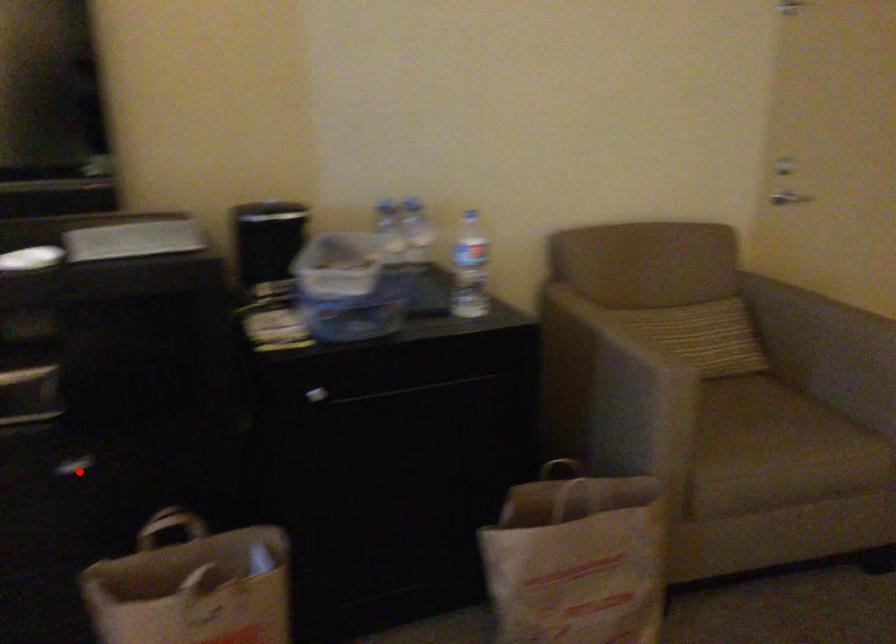
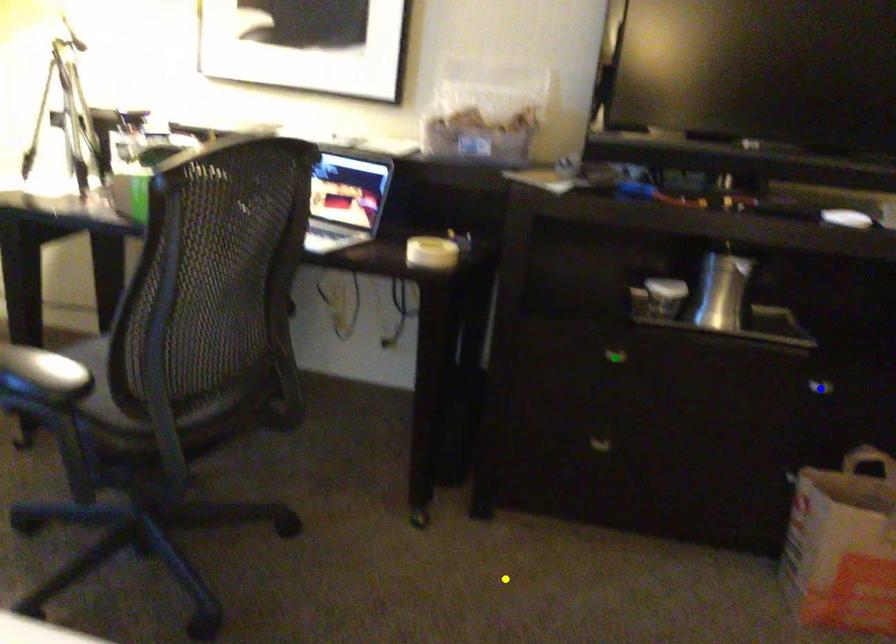
Question: I am providing you with two images of the same scene from different viewpoints. A red point is marked on the first image. You are given multiple points on the second image. Which spot in image 2 lines up with the point in image 1?

Choices:
 (A) green point
 (B) yellow point
 (C) blue point

Answer: (C)